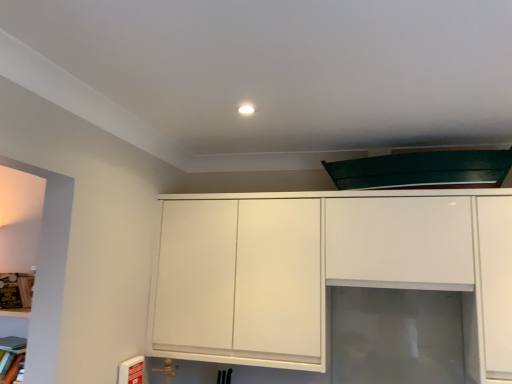
Question: Do you think white glossy cabinet at center is within transparent glass door at center, or outside of it?

Choices:
 (A) inside
 (B) outside

Answer: (B)

Question: Looking at their shapes, would you say white glossy cabinet at center is wider or thinner than transparent glass door at center?

Choices:
 (A) thin
 (B) wide

Answer: (B)

Question: Considering the real-world distances, which object is closest to the white glossy cabinet at center?

Choices:
 (A) transparent glass door at center
 (B) wooden bookshelf at left

Answer: (A)

Question: Based on their relative distances, which object is farther from the wooden bookshelf at left?

Choices:
 (A) transparent glass door at center
 (B) white glossy cabinet at center

Answer: (A)